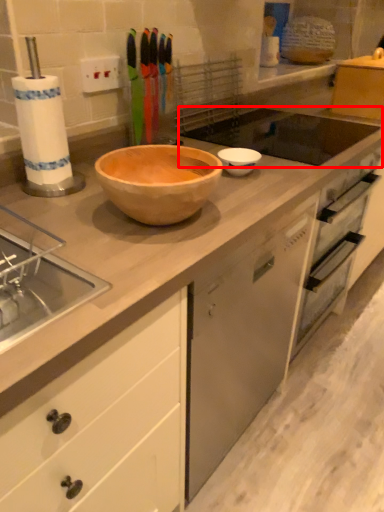
Question: From the image, what is the correct spatial relationship of sink (annotated by the red box) in relation to basin?

Choices:
 (A) right
 (B) left

Answer: (A)